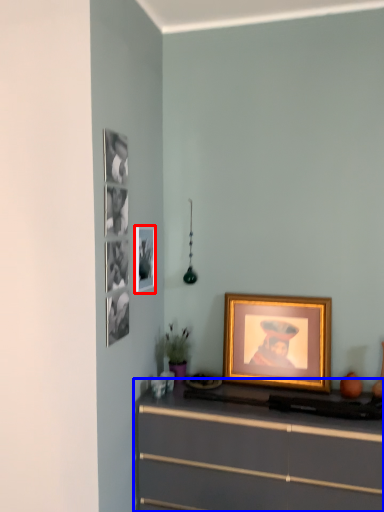
Question: Which object appears closest to the camera in this image, picture frame (highlighted by a red box) or chest of drawers (highlighted by a blue box)?

Choices:
 (A) picture frame
 (B) chest of drawers

Answer: (B)